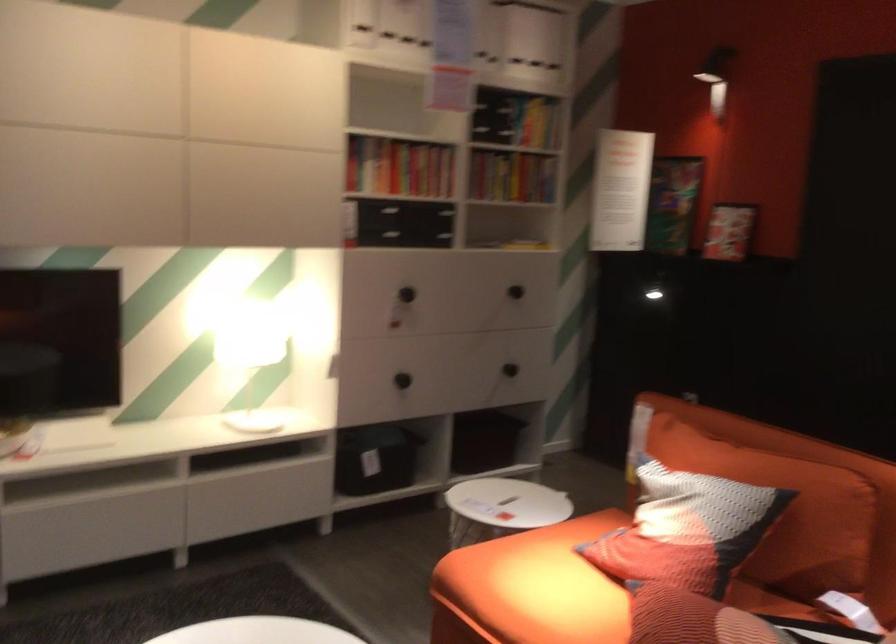
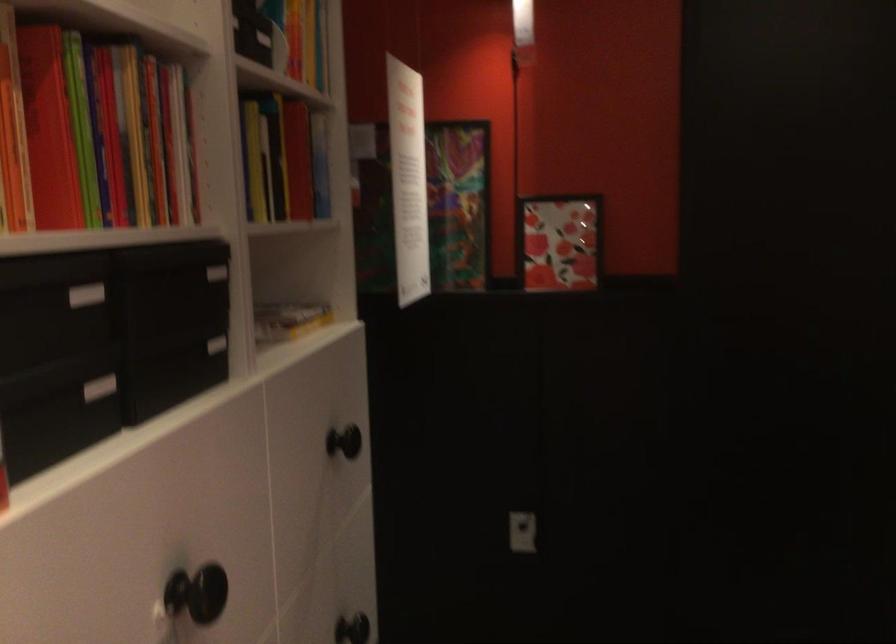
The point at (412, 279) is marked in the first image. Where is the corresponding point in the second image?

(196, 592)